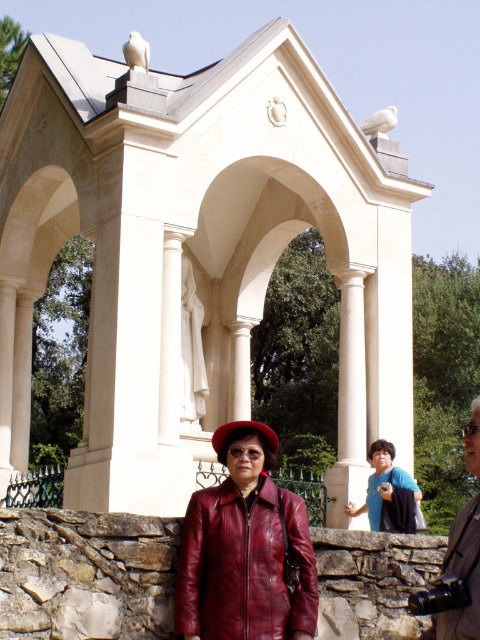
Which of these two, leather jacket at center or blue fabric bag at center, stands taller?

A: Standing taller between the two is leather jacket at center.

This screenshot has width=480, height=640. I want to click on leather jacket at center, so click(x=243, y=564).

Identify the location of leather jacket at center. (243, 564).

Based on the photo, is dark brown leather jacket at lower right below red leather hat at center?

Indeed, dark brown leather jacket at lower right is positioned under red leather hat at center.

Can you confirm if dark brown leather jacket at lower right is wider than red leather hat at center?

Yes.

Is point (467, 422) positioned in front of point (254, 422)?

No, (467, 422) is further to viewer.

I want to click on dark brown leather jacket at lower right, so click(x=462, y=573).

Is point (311, 580) farther from camera compared to point (471, 561)?

Yes, point (311, 580) is farther from viewer.

Can you confirm if leather jacket at center is smaller than dark brown leather jacket at lower right?

Indeed, leather jacket at center has a smaller size compared to dark brown leather jacket at lower right.

Identify the location of leather jacket at center. (243, 564).